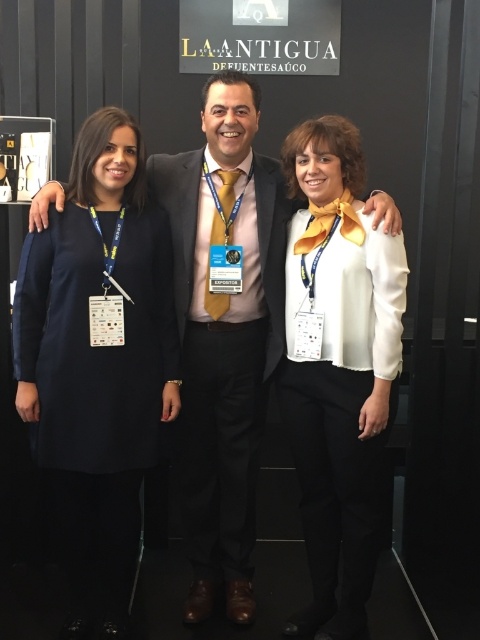
Is point (35, 444) farther from viewer compared to point (355, 541)?

No, (35, 444) is in front of (355, 541).

Who is more forward, (x=63, y=406) or (x=311, y=492)?

Point (x=63, y=406) is more forward.

At what (x,y) coordinates should I click in order to perform the action: click on matte black dress at left. Please return your answer as a coordinate pair (x, y). This screenshot has width=480, height=640. Looking at the image, I should click on (98, 360).

Where is `matte black dress at left`? The height and width of the screenshot is (640, 480). matte black dress at left is located at coordinates 98,360.

Which of these two, white satin blouse at center or satin black suit at center, stands shorter?

Standing shorter between the two is satin black suit at center.

The width and height of the screenshot is (480, 640). Find the location of `white satin blouse at center`. white satin blouse at center is located at coordinates (338, 369).

Does point (317, 157) come closer to viewer compared to point (240, 461)?

Yes.

Identify the location of white satin blouse at center. This screenshot has width=480, height=640. (338, 369).